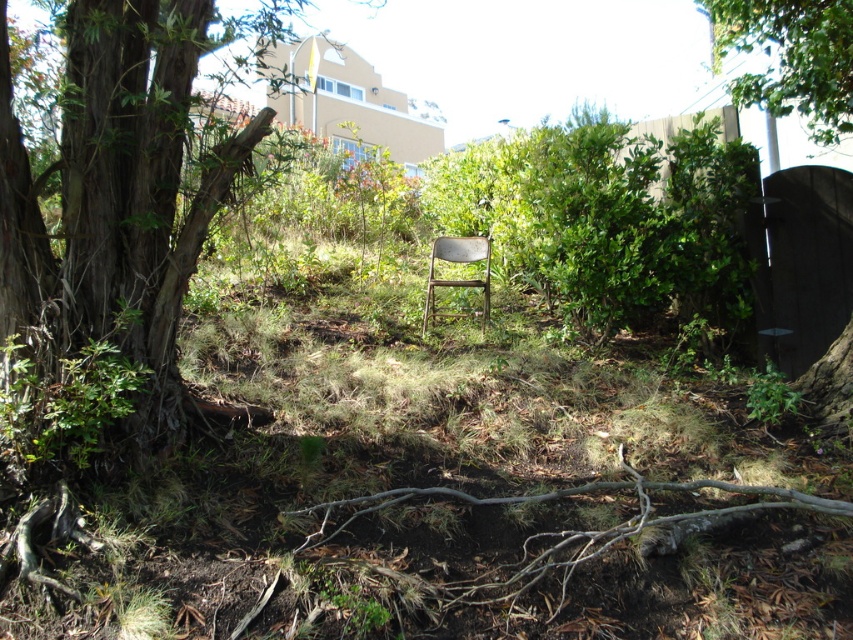
You are standing in the garden and want to place a small potted plant between the green leafy bush at center and the green leafy tree at upper right. Based on their positions, which side of the tree should you place the potted plant?

The green leafy bush at center is positioned on the left side of the green leafy tree at upper right, so you should place the potted plant to the left side of the green leafy tree at upper right.

You are planning to set up a picnic blanket between the green leafy tree at left and the green leafy tree at upper right. If the picnic blanket is 2 meters wide, will it fit between them without overlapping either tree?

The distance between the green leafy tree at left and the green leafy tree at upper right is 2.66 meters. Since the picnic blanket is 2 meters wide, it will fit between them with some space to spare.

You are standing in the garden and want to walk from the green leafy bush at center to the green leafy tree at upper right. Which direction should you move to get closer to the tree?

To get closer to the green leafy tree at upper right, you should move away from the green leafy bush at center since it is closer to you than the tree.